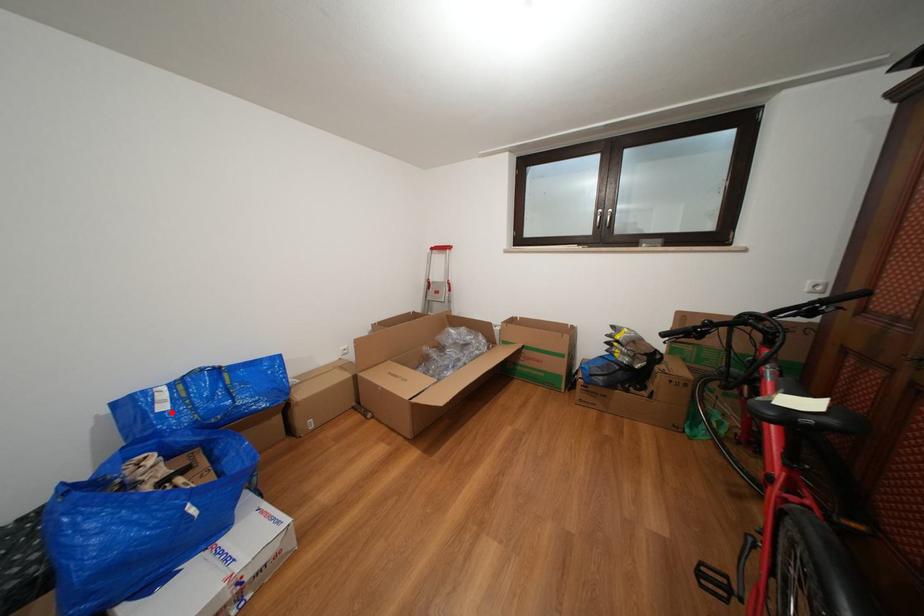
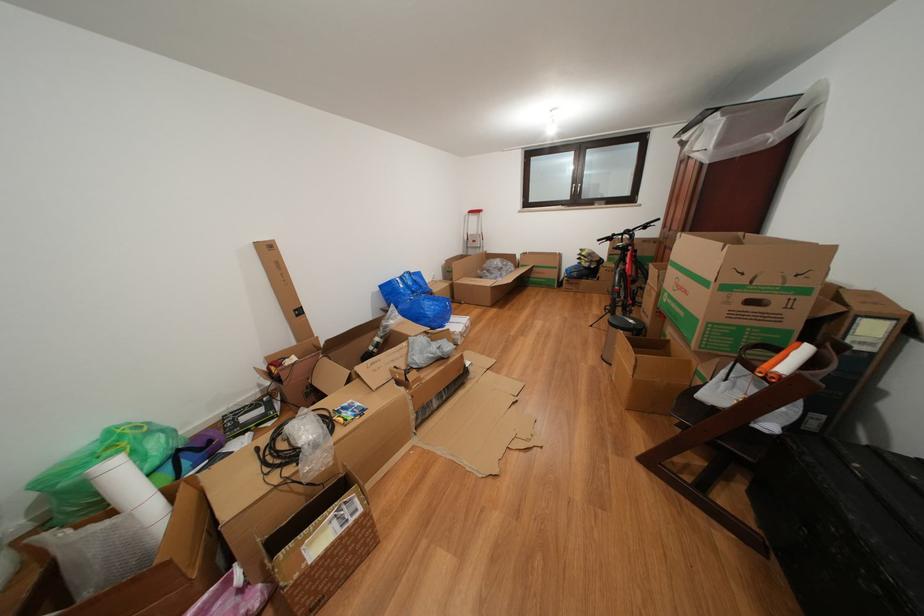
Question: I am providing you with two images of the same scene from different viewpoints. A red point is marked on the first image. Is the red point's position out of view in image 2?

Choices:
 (A) Yes
 (B) No

Answer: (B)